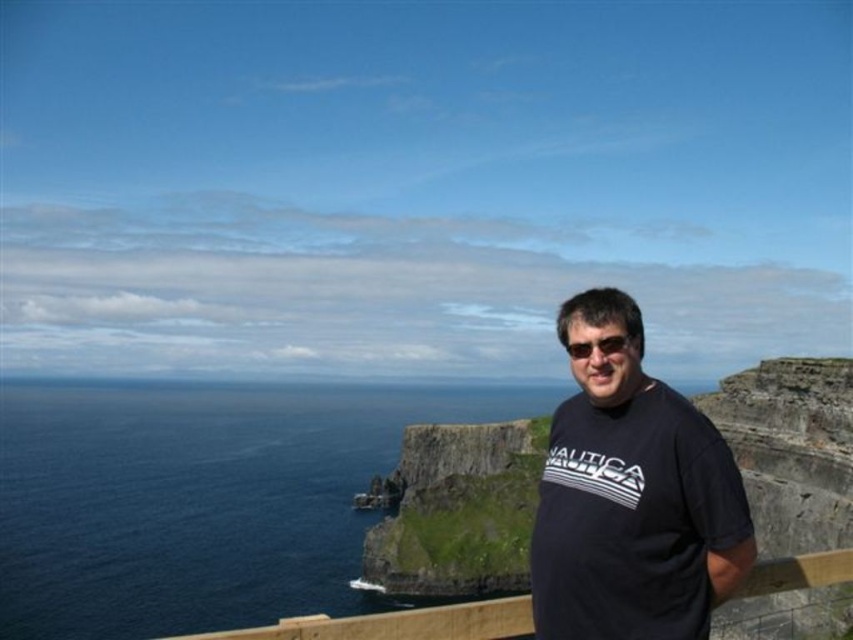
You are a photographer trying to capture the coastal view. You have two markers on your camera screen at coordinates point (473, 465) and point (602, 340). Which marker is closer to the foreground person?

Point (602, 340) is closer to the foreground person because it is in front of point (473, 465), which is behind it.